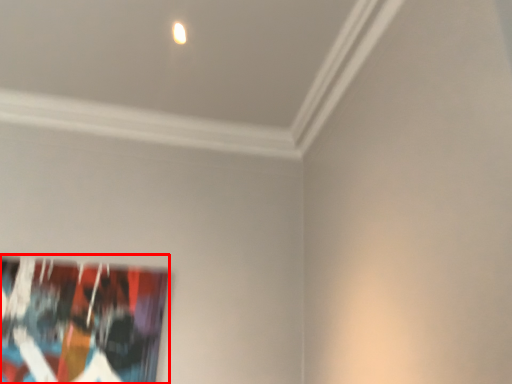
Question: From the image's perspective, where is picture frame (annotated by the red box) located relative to light?

Choices:
 (A) above
 (B) below

Answer: (B)